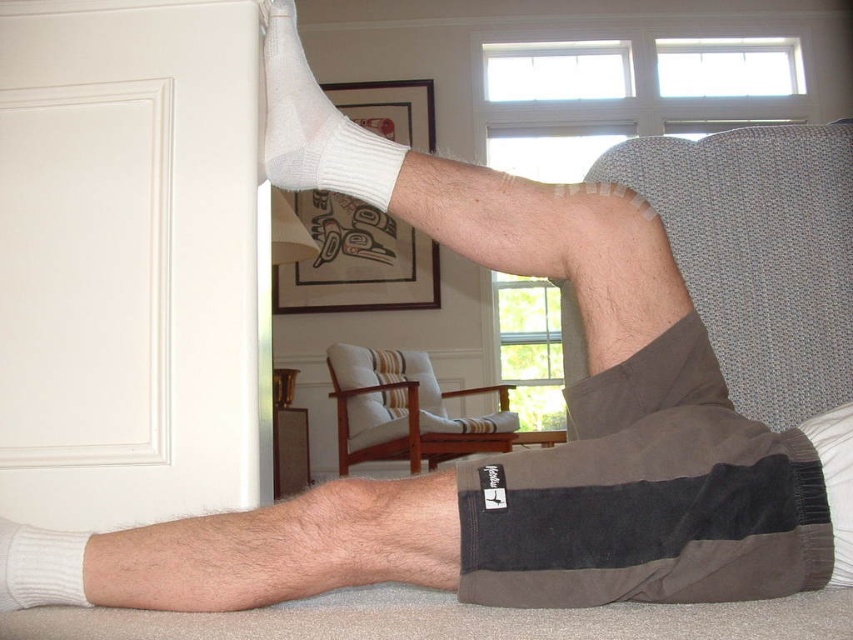
Which is behind, point (316, 97) or point (16, 570)?

Positioned behind is point (316, 97).

Does white cotton sock at upper left have a lesser width compared to white knitted sock at lower left?

No.

Describe the element at coordinates (317, 125) in the screenshot. I see `white cotton sock at upper left` at that location.

Where is `white cotton sock at upper left`? The height and width of the screenshot is (640, 853). white cotton sock at upper left is located at coordinates (317, 125).